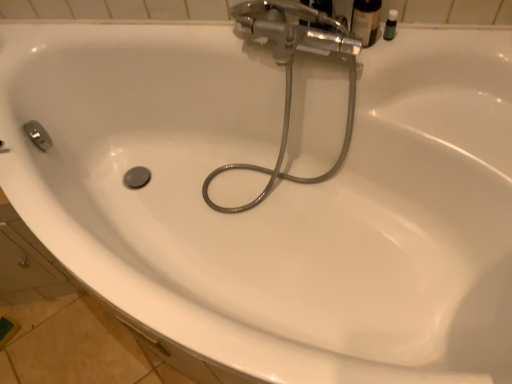
Question: Would you say green matte bottle at upper right, which appears as the 1th toiletry when viewed from the right, contains metallic hose at center?

Choices:
 (A) no
 (B) yes

Answer: (A)

Question: Considering the relative sizes of green matte bottle at upper right, the second toiletry when ordered from left to right, and metallic hose at center in the image provided, is green matte bottle at upper right, the second toiletry when ordered from left to right, taller than metallic hose at center?

Choices:
 (A) yes
 (B) no

Answer: (B)

Question: Does green matte bottle at upper right, the second toiletry when ordered from left to right, have a lesser height compared to metallic hose at center?

Choices:
 (A) yes
 (B) no

Answer: (A)

Question: Can you confirm if green matte bottle at upper right, which appears as the 1th toiletry when viewed from the right, is bigger than metallic hose at center?

Choices:
 (A) no
 (B) yes

Answer: (A)

Question: Is green matte bottle at upper right, the second toiletry when ordered from left to right, at the right side of metallic hose at center?

Choices:
 (A) yes
 (B) no

Answer: (A)

Question: Is point (396, 16) positioned closer to the camera than point (364, 28)?

Choices:
 (A) farther
 (B) closer

Answer: (A)

Question: In terms of height, does green matte bottle at upper right, which appears as the 1th toiletry when viewed from the right, look taller or shorter compared to matte black bottle at upper right, the second toiletry from the right?

Choices:
 (A) tall
 (B) short

Answer: (B)

Question: From the image's perspective, is green matte bottle at upper right, the second toiletry when ordered from left to right, above or below matte black bottle at upper right, the first toiletry from the left?

Choices:
 (A) below
 (B) above

Answer: (A)

Question: Would you say green matte bottle at upper right, which appears as the 1th toiletry when viewed from the right, is inside or outside matte black bottle at upper right, the first toiletry from the left?

Choices:
 (A) outside
 (B) inside

Answer: (A)

Question: From the image's perspective, relative to green matte bottle at upper right, the second toiletry when ordered from left to right, is metallic hose at center above or below?

Choices:
 (A) above
 (B) below

Answer: (B)

Question: From a real-world perspective, is metallic hose at center above or below green matte bottle at upper right, which appears as the 1th toiletry when viewed from the right?

Choices:
 (A) above
 (B) below

Answer: (B)

Question: Is metallic hose at center wider or thinner than green matte bottle at upper right, the second toiletry when ordered from left to right?

Choices:
 (A) wide
 (B) thin

Answer: (A)

Question: Does point (280, 4) appear closer or farther from the camera than point (391, 29)?

Choices:
 (A) farther
 (B) closer

Answer: (B)

Question: Is matte black bottle at upper right, the first toiletry from the left, in front of or behind metallic hose at center in the image?

Choices:
 (A) front
 (B) behind

Answer: (B)

Question: From their relative heights in the image, would you say matte black bottle at upper right, the first toiletry from the left, is taller or shorter than metallic hose at center?

Choices:
 (A) tall
 (B) short

Answer: (B)